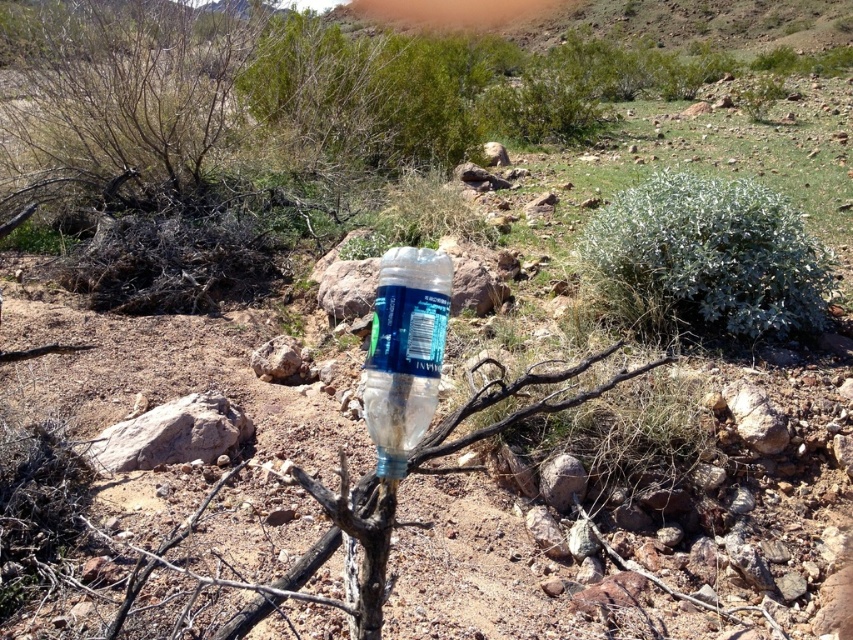
Can you confirm if transparent plastic bottle at center is wider than clear plastic branch at center?

No.

Between point (368, 390) and point (288, 589), which one is positioned behind?

Point (288, 589)

Between point (370, 390) and point (439, 438), which one is positioned in front?

Positioned in front is point (370, 390).

What are the coordinates of `transparent plastic bottle at center` in the screenshot? It's located at (405, 353).

Does green fuzzy bush at center right have a lesser width compared to clear plastic branch at center?

No.

Locate an element on the screen. This screenshot has height=640, width=853. green fuzzy bush at center right is located at coordinates (706, 259).

From the picture: Does green fuzzy bush at center right have a lesser width compared to transparent plastic bottle at center?

In fact, green fuzzy bush at center right might be wider than transparent plastic bottle at center.

Can you confirm if green fuzzy bush at center right is positioned to the right of transparent plastic bottle at center?

Yes, green fuzzy bush at center right is to the right of transparent plastic bottle at center.

Between point (689, 253) and point (378, 406), which one is positioned behind?

The point (689, 253) is behind.

Identify the location of green fuzzy bush at center right. The width and height of the screenshot is (853, 640). (706, 259).